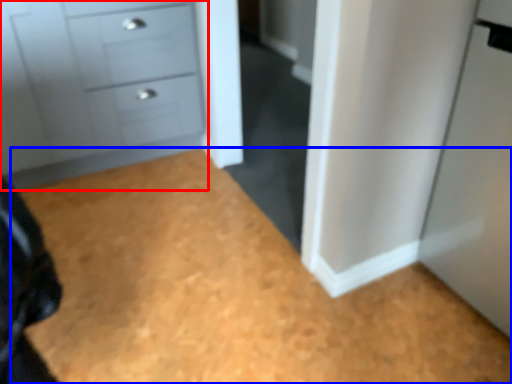
Question: Which object appears closest to the camera in this image, chest of drawers (highlighted by a red box) or plain (highlighted by a blue box)?

Choices:
 (A) chest of drawers
 (B) plain

Answer: (B)